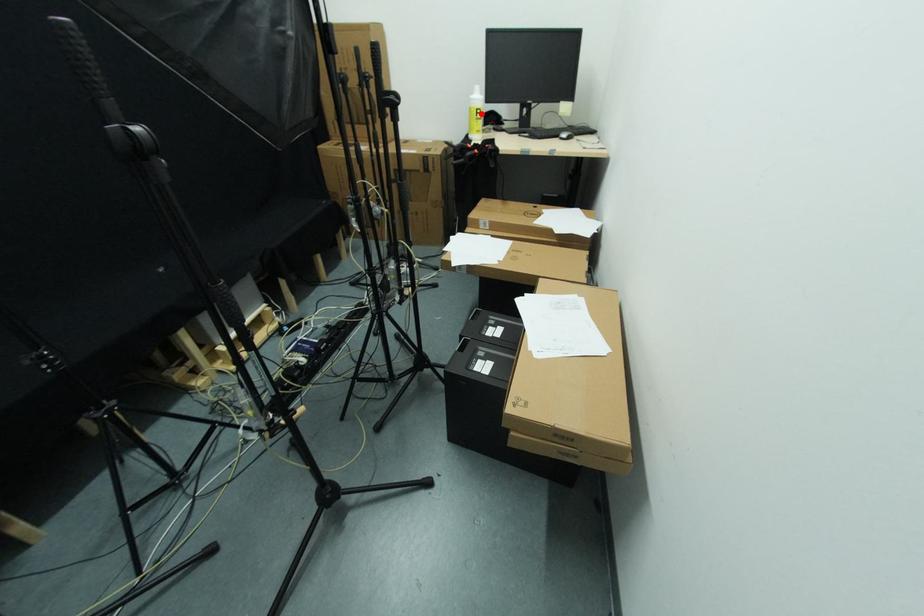
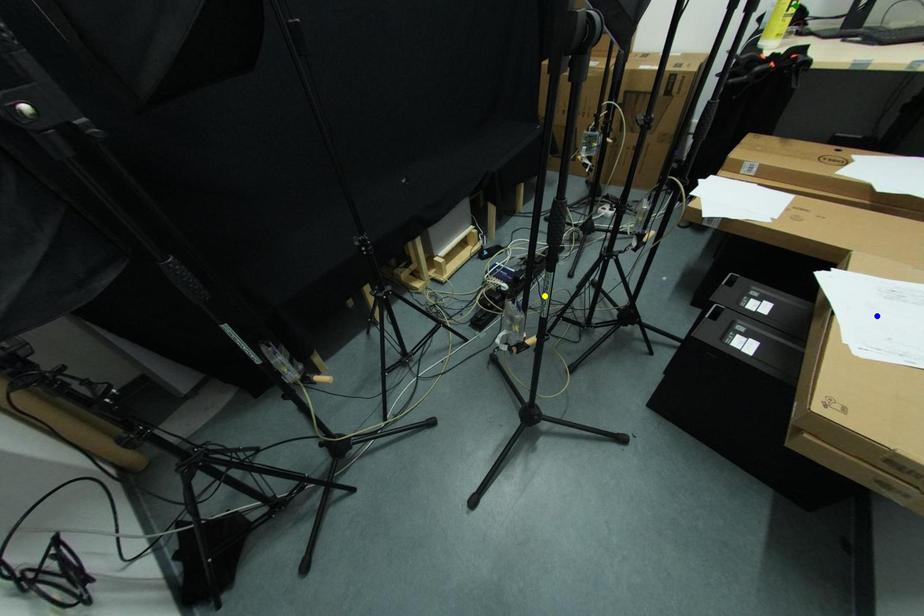
Question: I am providing you with two images of the same scene from different viewpoints. A red point is marked on the first image. You are given multiple points on the second image. Which point in image 2 represents the same 3d spot as the red point in image 1?

Choices:
 (A) yellow point
 (B) blue point
 (C) green point

Answer: (C)